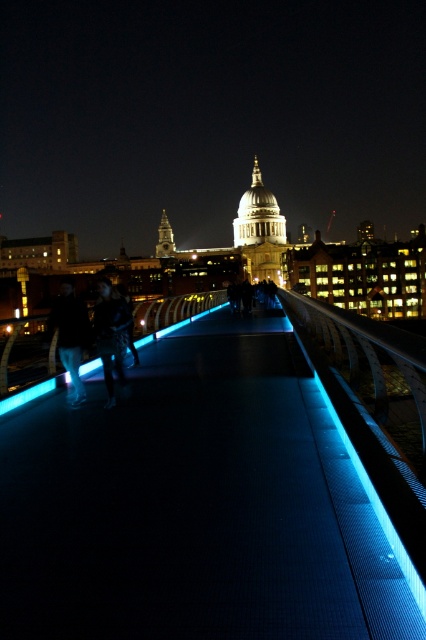
Question: Can you confirm if dark blue jeans at left is smaller than dark blue leather jacket at center?

Choices:
 (A) no
 (B) yes

Answer: (B)

Question: Among these points, which one is nearest to the camera?

Choices:
 (A) (103, 339)
 (B) (74, 403)

Answer: (B)

Question: Which point is farther from the camera taking this photo?

Choices:
 (A) (72, 304)
 (B) (118, 356)

Answer: (A)

Question: Can you confirm if dark blue jeans at left is positioned to the right of dark blue leather jacket at center?

Choices:
 (A) yes
 (B) no

Answer: (B)

Question: Can you confirm if dark blue jeans at left is wider than dark blue leather jacket at center?

Choices:
 (A) no
 (B) yes

Answer: (A)